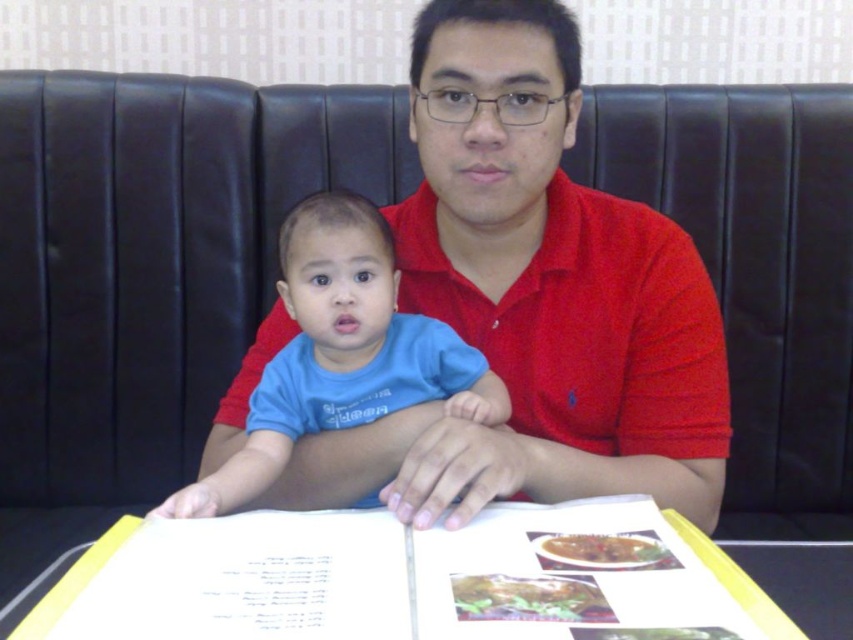
Question: Can you confirm if red cotton shirt at center is thinner than yellow paper menu at center?

Choices:
 (A) yes
 (B) no

Answer: (B)

Question: Estimate the real-world distances between objects in this image. Which object is farther from the blue cotton shirt at center?

Choices:
 (A) yellow paper menu at center
 (B) red cotton shirt at center

Answer: (A)

Question: Can you confirm if red cotton shirt at center is wider than yellow paper menu at center?

Choices:
 (A) no
 (B) yes

Answer: (B)

Question: Which of the following is the farthest from the observer?

Choices:
 (A) (62, 557)
 (B) (695, 332)
 (C) (260, 396)

Answer: (A)

Question: Where is blue cotton shirt at center located in relation to yellow paper menu at center in the image?

Choices:
 (A) left
 (B) right

Answer: (A)

Question: Which of the following is the farthest from the observer?

Choices:
 (A) (258, 332)
 (B) (109, 513)

Answer: (B)